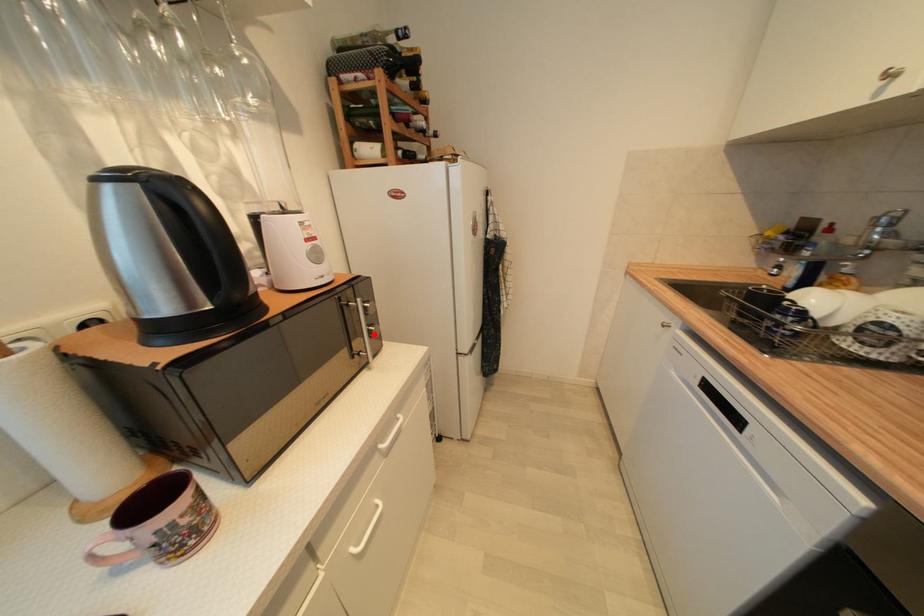
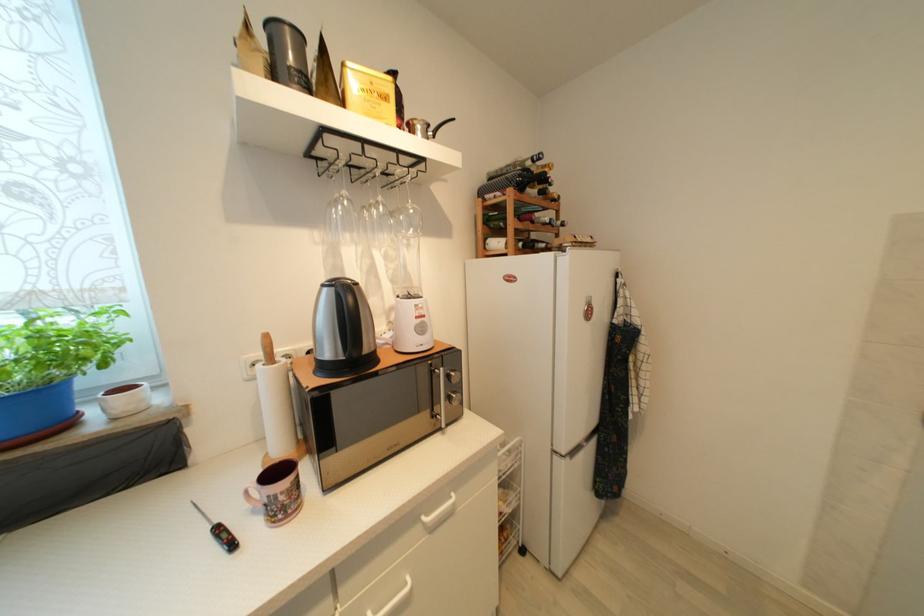
Question: I am providing you with two images of the same scene from different viewpoints. In image1, a red point is highlighted. Considering the same 3D point in image2, which of the following is correct?

Choices:
 (A) It is closer
 (B) It is farther

Answer: (B)